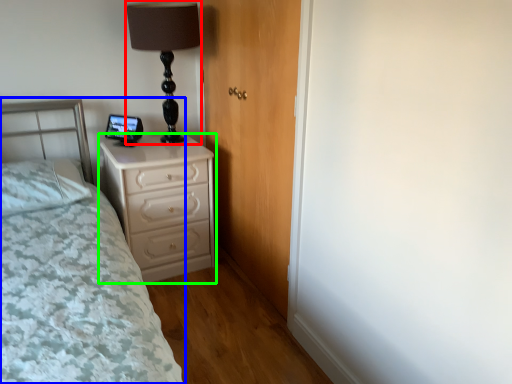
Question: Which object is positioned farthest from table lamp (highlighted by a red box)? Select from bed (highlighted by a blue box) and chest of drawers (highlighted by a green box).

Choices:
 (A) bed
 (B) chest of drawers

Answer: (A)